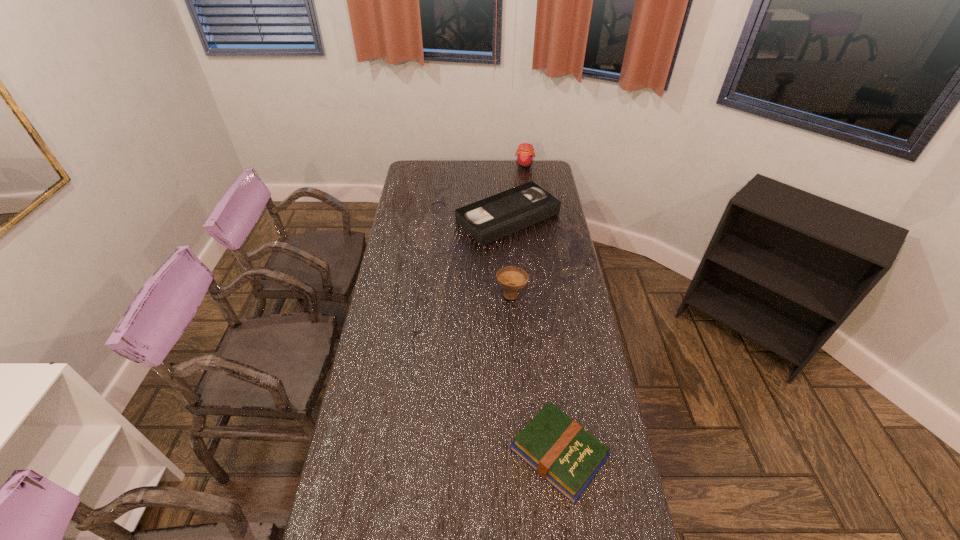
Where is `videotape that is at the right edge`? This screenshot has width=960, height=540. videotape that is at the right edge is located at coordinates (492, 218).

This screenshot has height=540, width=960. I want to click on book that is positioned at the right edge, so click(560, 450).

Identify the location of object at the far right corner. This screenshot has height=540, width=960. (525, 155).

Where is `vacant space at the far edge`? Image resolution: width=960 pixels, height=540 pixels. vacant space at the far edge is located at coordinates (510, 163).

Locate an element on the screen. The height and width of the screenshot is (540, 960). vacant space at the left edge of the desktop is located at coordinates (355, 534).

Where is `vacant region at the right edge of the desktop`? The image size is (960, 540). vacant region at the right edge of the desktop is located at coordinates pyautogui.click(x=580, y=314).

The width and height of the screenshot is (960, 540). I want to click on free space between the videotape and the soup bowl, so click(510, 255).

In order to click on free space between the book and the soup bowl in this screenshot , I will do `click(536, 373)`.

I want to click on vacant area between the soup bowl and the book, so click(536, 373).

Choose which object is the second nearest neighbor to the videotape. Please provide its 2D coordinates. Your answer should be formatted as a tuple, i.e. [(x, y)], where the tuple contains the x and y coordinates of a point satisfying the conditions above.

[(512, 279)]